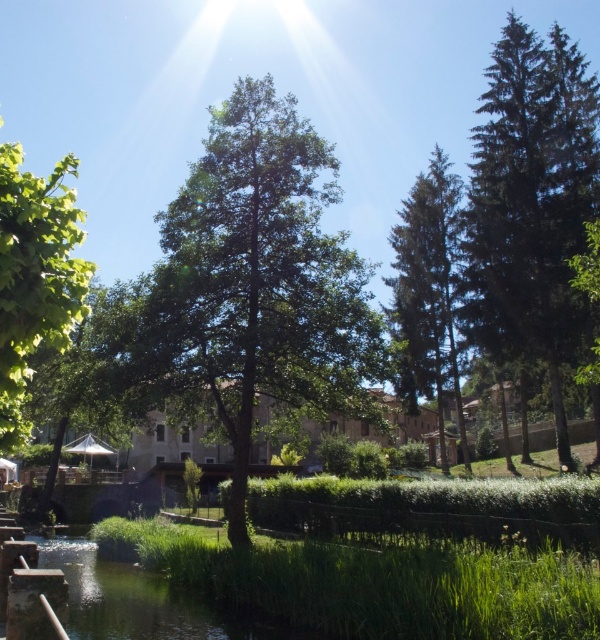
In the scene shown: Who is shorter, green leafy tree at center or green textured pine tree at upper right?

With less height is green leafy tree at center.

Who is positioned more to the right, green leafy tree at center or green textured pine tree at upper right?

Positioned to the right is green textured pine tree at upper right.

Where is `green leafy tree at center`? This screenshot has width=600, height=640. green leafy tree at center is located at coordinates (245, 288).

Find the location of `green leafy tree at center`. green leafy tree at center is located at coordinates (245, 288).

Does point (51, 188) lie in front of point (435, 200)?

Yes, it is in front of point (435, 200).

Who is taller, green leafy tree at left or green textured pine tree at upper right?

green textured pine tree at upper right

Who is more distant from viewer, [16,426] or [444,310]?

Positioned behind is point [444,310].

You are a GUI agent. You are given a task and a screenshot of the screen. Output one action in this format:
    pyautogui.click(x=<x>, y=<y>)
    Task: Click on the green leafy tree at left
    
    Given the screenshot: What is the action you would take?
    pyautogui.click(x=36, y=276)

Is green leafy tree at center shorter than green leafy tree at left?

In fact, green leafy tree at center may be taller than green leafy tree at left.

Can you confirm if green leafy tree at center is positioned to the left of green leafy tree at left?

Incorrect, green leafy tree at center is not on the left side of green leafy tree at left.

Image resolution: width=600 pixels, height=640 pixels. I want to click on green leafy tree at center, so click(x=245, y=288).